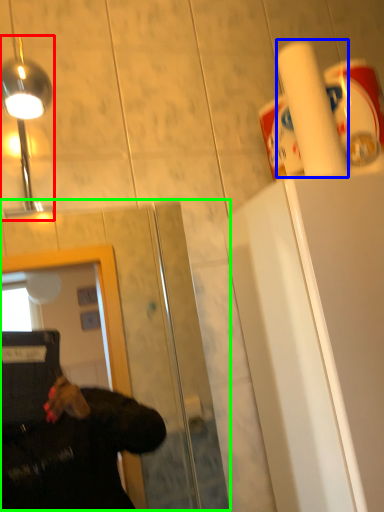
Question: Which object is positioned farthest from light fixture (highlighted by a red box)? Select from paper towel (highlighted by a blue box) and glass door (highlighted by a green box).

Choices:
 (A) paper towel
 (B) glass door

Answer: (B)